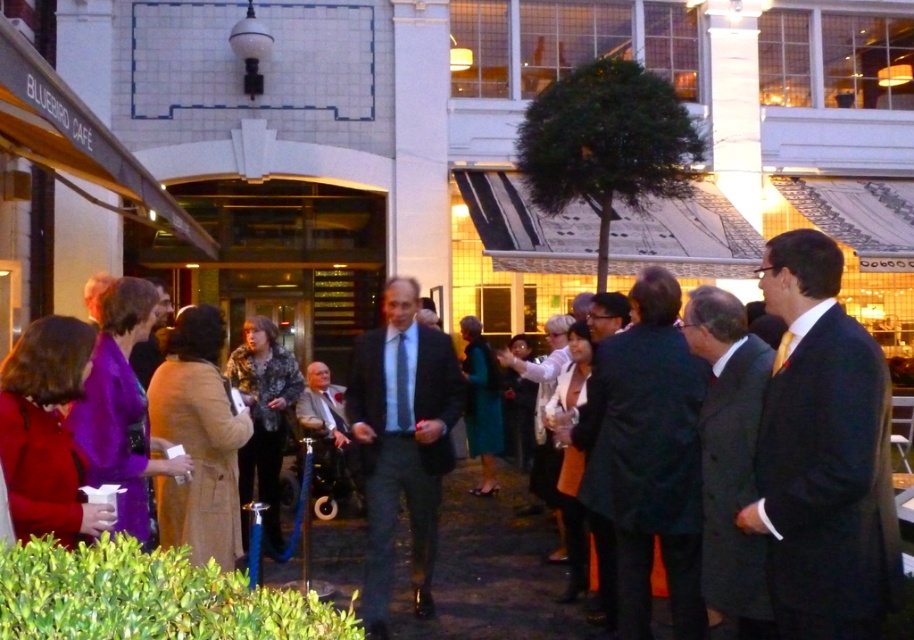
Question: Based on their relative distances, which object is farther from the dark gray suit at center?

Choices:
 (A) gray fabric suit at center
 (B) dark suit at right
 (C) matte black suit at center
 (D) black wool coat at center

Answer: (A)

Question: Is dark suit at right behind black wool coat at center?

Choices:
 (A) yes
 (B) no

Answer: (B)

Question: Based on their relative distances, which object is nearer to the dark suit at right?

Choices:
 (A) gray fabric suit at center
 (B) black wool coat at center
 (C) matte black suit at center

Answer: (B)

Question: Is black wool coat at center below gray fabric suit at center?

Choices:
 (A) no
 (B) yes

Answer: (A)

Question: Can you confirm if matte black suit at center is smaller than gray fabric suit at center?

Choices:
 (A) no
 (B) yes

Answer: (A)

Question: Which point is farther to the camera?

Choices:
 (A) dark gray suit at center
 (B) gray fabric suit at center
 (C) black wool coat at center
 (D) matte black suit at center

Answer: (B)